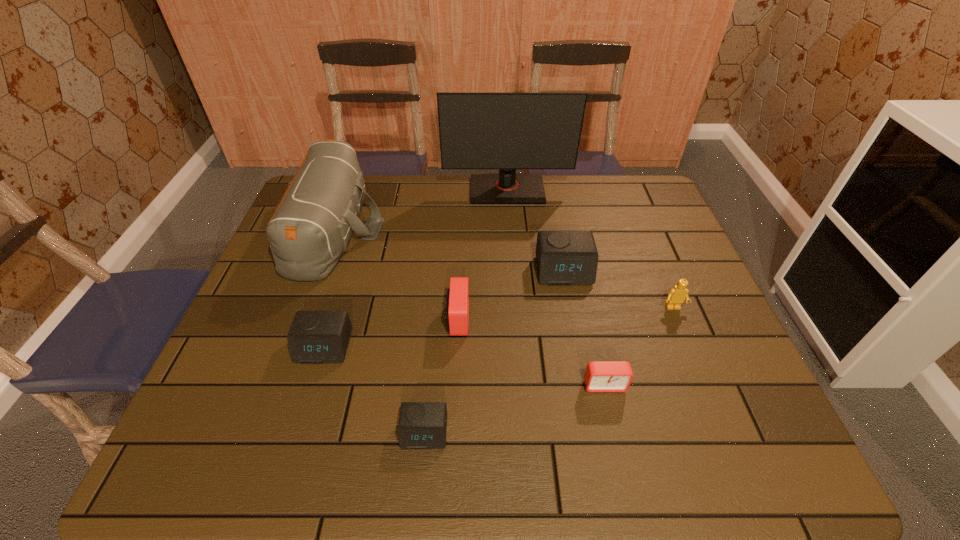
I want to click on vacant space at the right edge of the desktop, so click(690, 321).

This screenshot has height=540, width=960. What are the coordinates of `vacant space at the far right corner of the desktop` in the screenshot? It's located at (609, 191).

Image resolution: width=960 pixels, height=540 pixels. What are the coordinates of `empty space that is in between the farther red alarm clock and the second nearest black alarm clock` in the screenshot? It's located at (391, 333).

The height and width of the screenshot is (540, 960). Find the location of `vacant area that lies between the shortest object and the seventh shortest object`. vacant area that lies between the shortest object and the seventh shortest object is located at coordinates (379, 331).

Locate an element on the screen. This screenshot has height=540, width=960. vacant area that lies between the second tallest object and the fourth farthest alarm clock is located at coordinates (469, 307).

Locate an element on the screen. Image resolution: width=960 pixels, height=540 pixels. free spot between the duffel bag and the nearest object is located at coordinates pyautogui.click(x=379, y=331).

Find the location of a particular element. Image resolution: width=960 pixels, height=540 pixels. free space between the Lego and the duffel bag is located at coordinates 504,269.

Locate an element on the screen. vacant region between the smallest black alarm clock and the seventh farthest object is located at coordinates (515, 409).

Locate an element on the screen. The height and width of the screenshot is (540, 960). vacant area that lies between the shortest object and the farther red alarm clock is located at coordinates (441, 376).

Where is `free space that is in between the black monitor and the farthest black alarm clock`? free space that is in between the black monitor and the farthest black alarm clock is located at coordinates (536, 230).